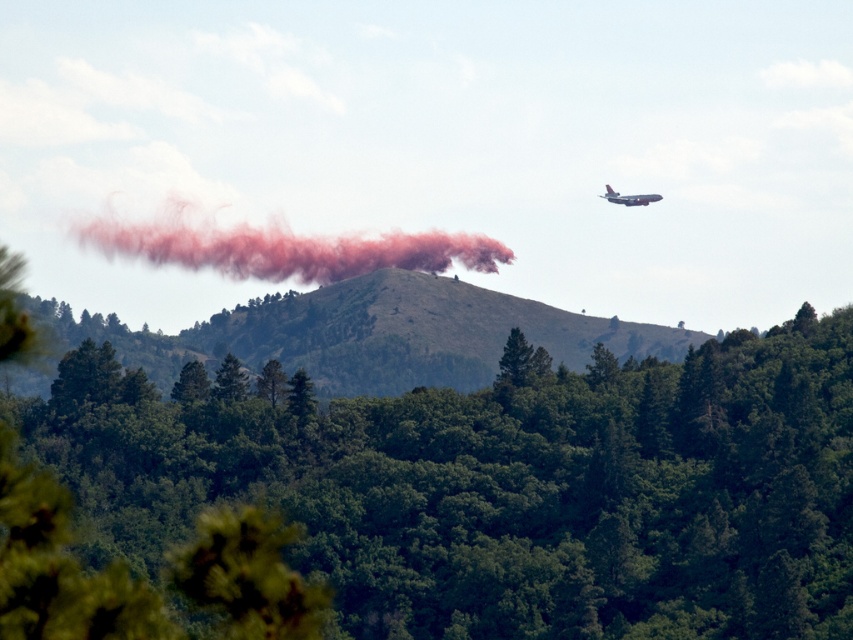
You are a pilot flying an airplane and see the image. You notice a point at coordinates (355, 336). What does this point represent in the scene?

The point at coordinates (355, 336) represents the smooth brown hill at center.